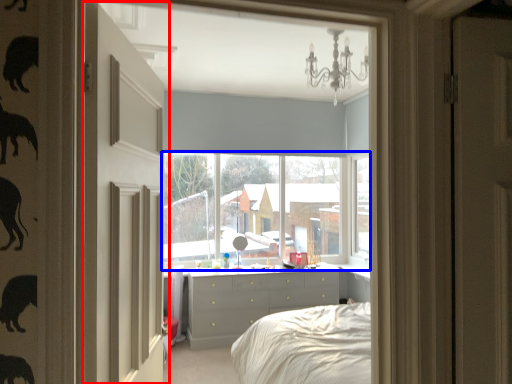
Question: Which object is further to the camera taking this photo, door (highlighted by a red box) or window (highlighted by a blue box)?

Choices:
 (A) door
 (B) window

Answer: (B)